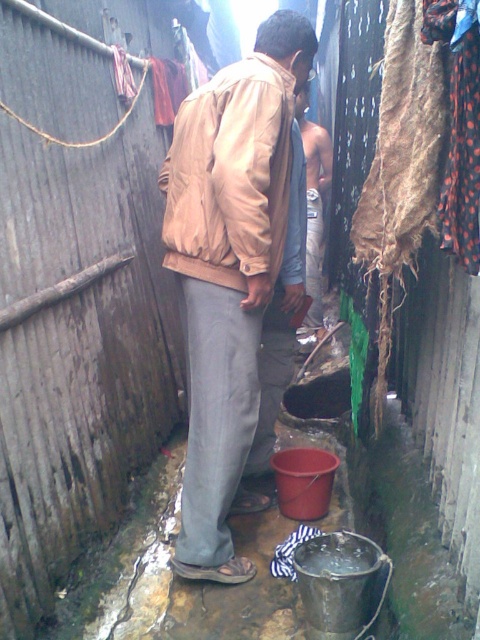
You are navigating through the alleyway and need to reach a specific location. There are two points marked in the scene. Which point is closer to you, point (272, 145) or point (320, 188)?

Point (272, 145) is closer to the viewer than point (320, 188).

You are navigating an alleyway and need to locate the matte beige jacket at center. According to the coordinates provided, where would you find it?

The matte beige jacket at center is located at the 2D coordinates point (229, 176).